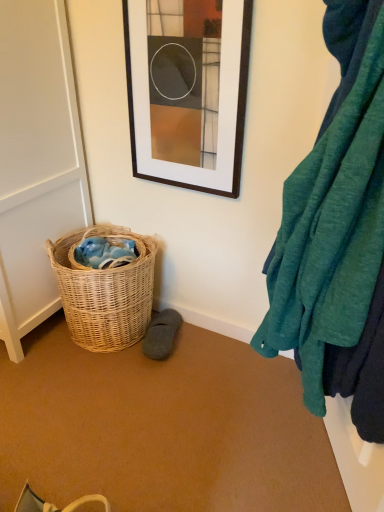
Question: Is white matte screen door at left touching woven natural basket at lower left?

Choices:
 (A) no
 (B) yes

Answer: (A)

Question: Considering the relative sizes of white matte screen door at left and woven natural basket at lower left in the image provided, is white matte screen door at left wider than woven natural basket at lower left?

Choices:
 (A) no
 (B) yes

Answer: (B)

Question: Considering the relative sizes of white matte screen door at left and woven natural basket at lower left in the image provided, is white matte screen door at left bigger than woven natural basket at lower left?

Choices:
 (A) no
 (B) yes

Answer: (B)

Question: From a real-world perspective, is white matte screen door at left positioned under woven natural basket at lower left based on gravity?

Choices:
 (A) yes
 (B) no

Answer: (B)

Question: Is white matte screen door at left closer to camera compared to woven natural basket at lower left?

Choices:
 (A) yes
 (B) no

Answer: (A)

Question: Is white matte screen door at left oriented away from woven natural basket at lower left?

Choices:
 (A) no
 (B) yes

Answer: (A)

Question: Is gray suede slipper at lower center facing towards white matte screen door at left?

Choices:
 (A) no
 (B) yes

Answer: (A)

Question: Is gray suede slipper at lower center at the right side of white matte screen door at left?

Choices:
 (A) yes
 (B) no

Answer: (A)

Question: Can you confirm if gray suede slipper at lower center is shorter than white matte screen door at left?

Choices:
 (A) no
 (B) yes

Answer: (B)

Question: Are gray suede slipper at lower center and white matte screen door at left making contact?

Choices:
 (A) yes
 (B) no

Answer: (B)

Question: Is gray suede slipper at lower center closer to camera compared to white matte screen door at left?

Choices:
 (A) yes
 (B) no

Answer: (B)

Question: Is gray suede slipper at lower center turned away from white matte screen door at left?

Choices:
 (A) yes
 (B) no

Answer: (B)

Question: Considering the relative positions of woven natural basket at lower left and teal soft fabric at right in the image provided, is woven natural basket at lower left to the right of teal soft fabric at right from the viewer's perspective?

Choices:
 (A) yes
 (B) no

Answer: (B)